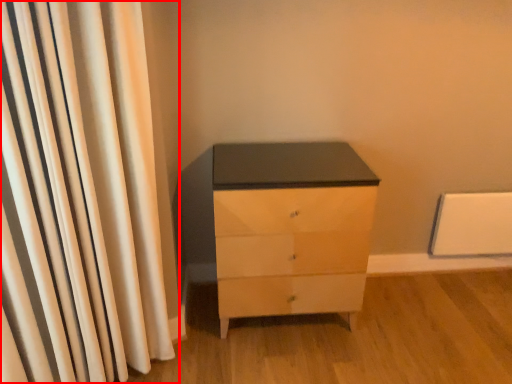
Question: Where is curtain (annotated by the red box) located in relation to chest of drawers in the image?

Choices:
 (A) right
 (B) left

Answer: (B)